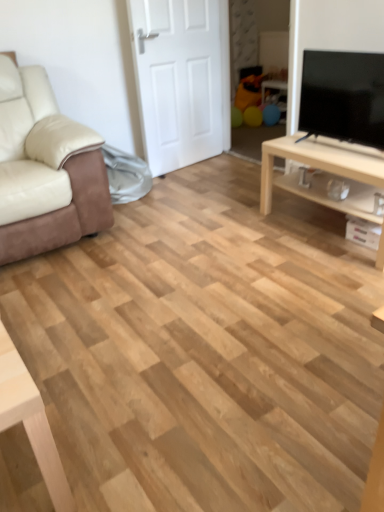
Question: Is black glossy tv at upper right oriented away from light wood/texture tv stand at right?

Choices:
 (A) no
 (B) yes

Answer: (A)

Question: Does black glossy tv at upper right have a lesser width compared to light wood/texture tv stand at right?

Choices:
 (A) no
 (B) yes

Answer: (B)

Question: Considering the relative sizes of black glossy tv at upper right and light wood/texture tv stand at right in the image provided, is black glossy tv at upper right shorter than light wood/texture tv stand at right?

Choices:
 (A) yes
 (B) no

Answer: (B)

Question: Is black glossy tv at upper right beside light wood/texture tv stand at right?

Choices:
 (A) no
 (B) yes

Answer: (A)

Question: Is black glossy tv at upper right positioned beyond the bounds of light wood/texture tv stand at right?

Choices:
 (A) yes
 (B) no

Answer: (A)

Question: In terms of width, does black glossy tv at upper right look wider or thinner when compared to beige leather couch at left?

Choices:
 (A) wide
 (B) thin

Answer: (B)

Question: Considering the relative positions of black glossy tv at upper right and beige leather couch at left in the image provided, is black glossy tv at upper right to the left or to the right of beige leather couch at left?

Choices:
 (A) left
 (B) right

Answer: (B)

Question: From the image's perspective, is black glossy tv at upper right above or below beige leather couch at left?

Choices:
 (A) below
 (B) above

Answer: (B)

Question: Considering the positions of black glossy tv at upper right and beige leather couch at left in the image, is black glossy tv at upper right bigger or smaller than beige leather couch at left?

Choices:
 (A) big
 (B) small

Answer: (B)

Question: Considering their positions, is light wood/texture tv stand at right located in front of or behind white matte door at center?

Choices:
 (A) behind
 (B) front

Answer: (B)

Question: Visually, is light wood/texture tv stand at right positioned to the left or to the right of white matte door at center?

Choices:
 (A) left
 (B) right

Answer: (B)

Question: From a real-world perspective, is light wood/texture tv stand at right positioned above or below white matte door at center?

Choices:
 (A) above
 (B) below

Answer: (B)

Question: Is light wood/texture tv stand at right bigger or smaller than white matte door at center?

Choices:
 (A) small
 (B) big

Answer: (B)

Question: Relative to light wood/texture tv stand at right, is beige leather couch at left in front or behind?

Choices:
 (A) behind
 (B) front

Answer: (B)

Question: In terms of width, does beige leather couch at left look wider or thinner when compared to light wood/texture tv stand at right?

Choices:
 (A) thin
 (B) wide

Answer: (B)